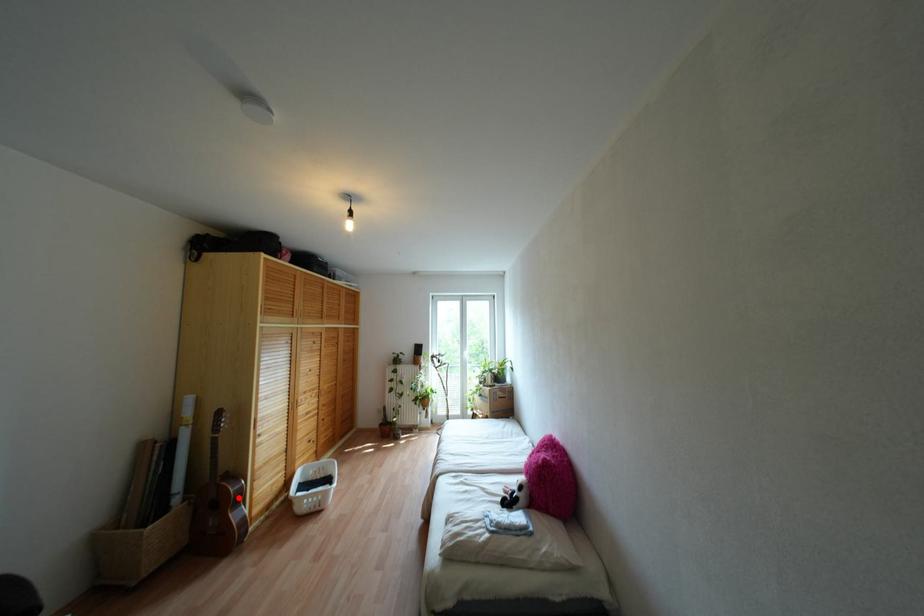
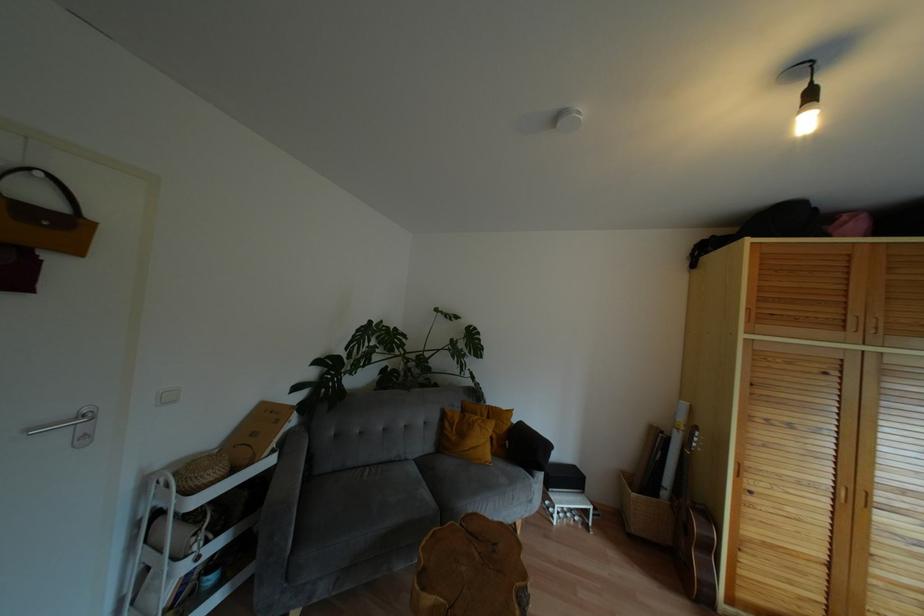
The point at the highlighted location is marked in the first image. Where is the corresponding point in the second image?

(710, 548)